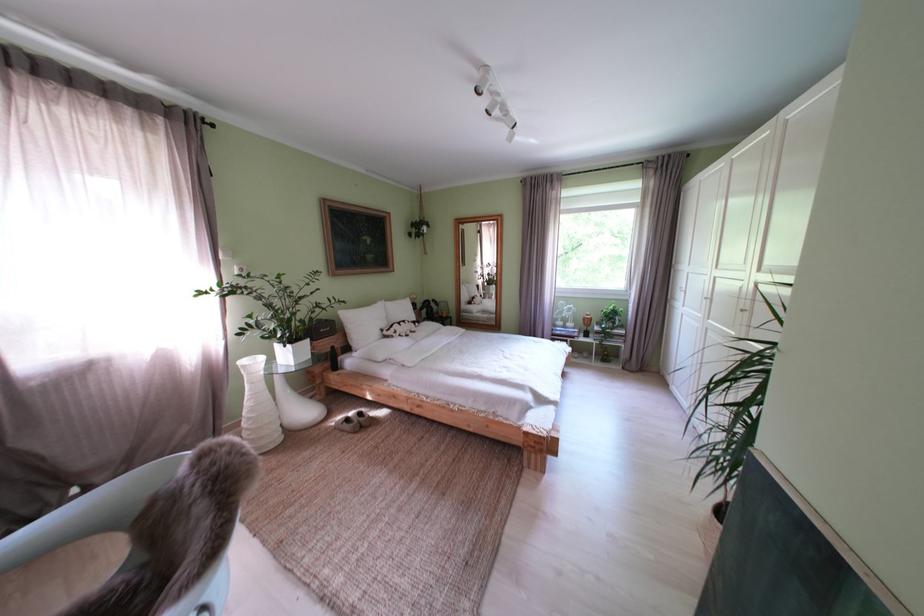
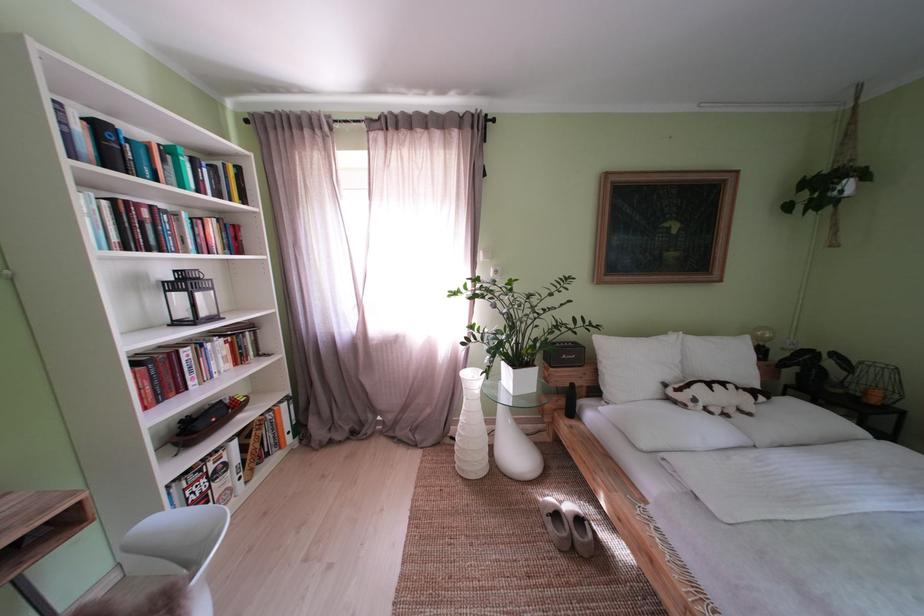
The point at (259, 408) is marked in the first image. Where is the corresponding point in the second image?

(472, 424)